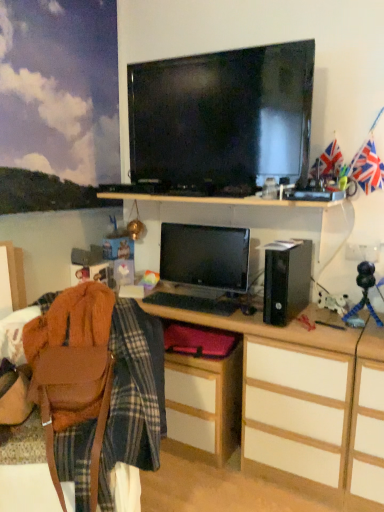
I want to click on free spot below black plastic speaker at right (from a real-world perspective), so click(294, 313).